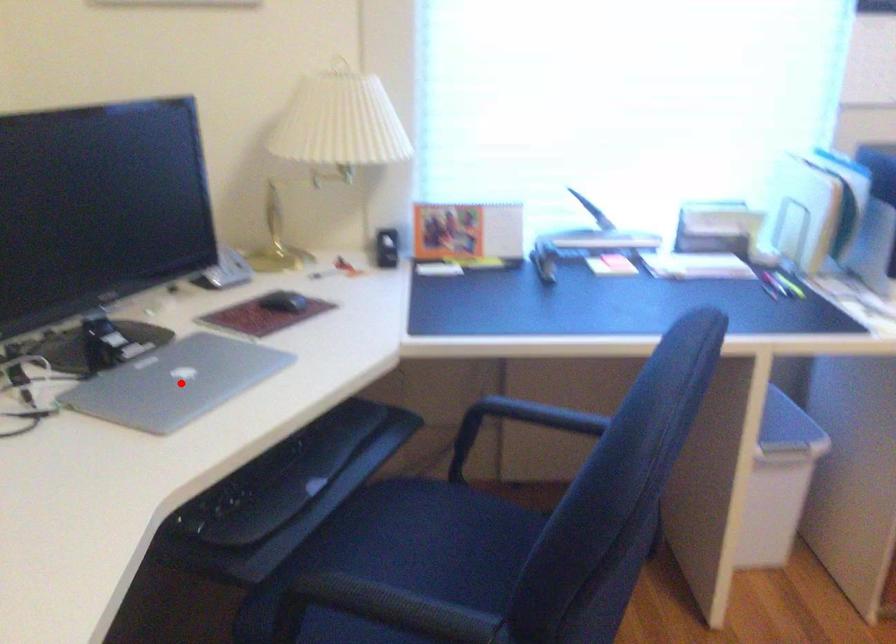
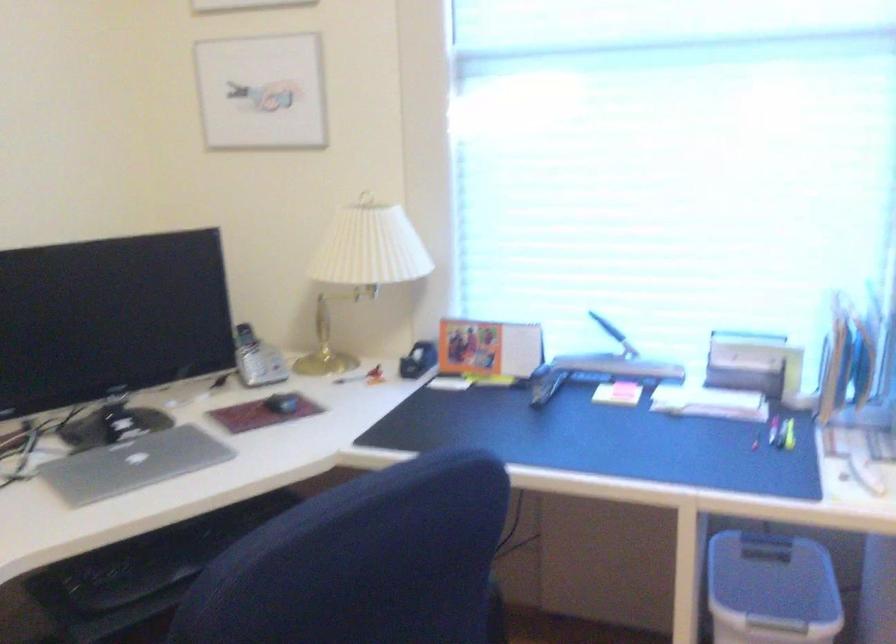
Find the pixel in the second image that matches the highlighted location in the first image.

(133, 464)